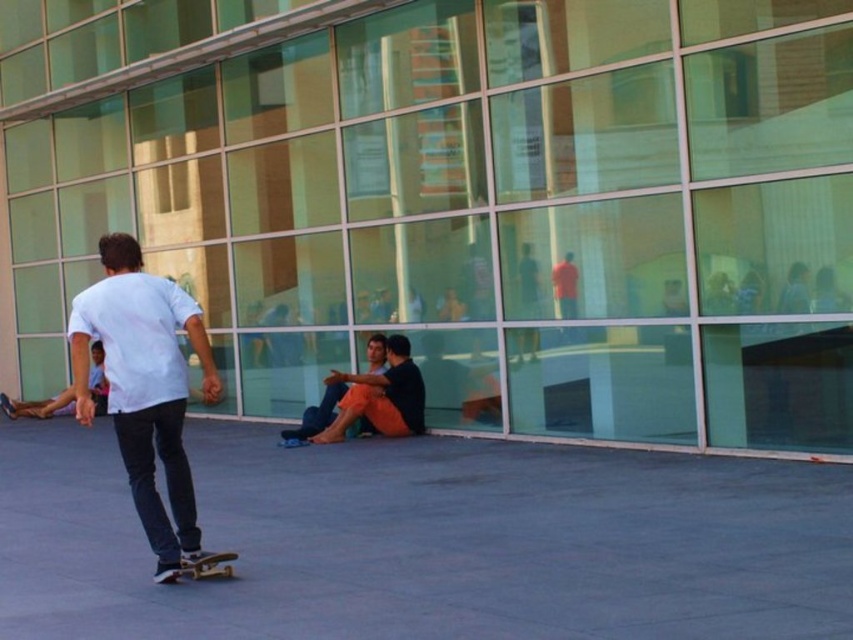
Question: Does gray concrete pavement at lower center lie behind orange cotton pants at center?

Choices:
 (A) yes
 (B) no

Answer: (B)

Question: Which point is closer to the camera?

Choices:
 (A) white matte shirt at center
 (B) wooden deck skateboard at lower center
 (C) gray concrete pavement at lower center
 (D) orange cotton pants at center

Answer: (C)

Question: Can you confirm if gray concrete pavement at lower center is thinner than white matte shirt at center?

Choices:
 (A) no
 (B) yes

Answer: (A)

Question: Is gray concrete pavement at lower center smaller than orange cotton pants at center?

Choices:
 (A) no
 (B) yes

Answer: (A)

Question: Which of the following is the closest to the observer?

Choices:
 (A) white matte shirt at center
 (B) wooden deck skateboard at lower center

Answer: (A)

Question: Which object is the farthest from the gray concrete pavement at lower center?

Choices:
 (A) white matte shirt at center
 (B) wooden deck skateboard at lower center

Answer: (A)